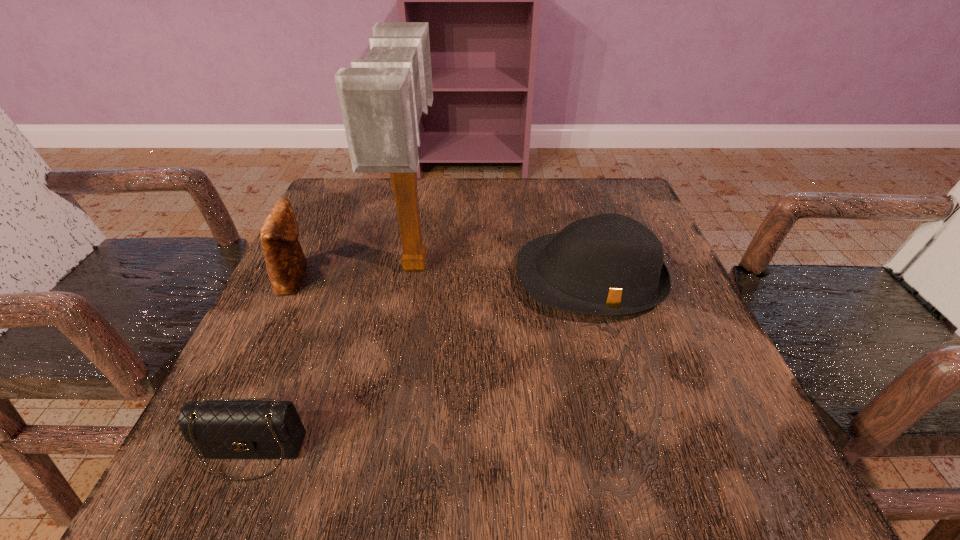
At what (x,y) coordinates should I click in order to perform the action: click on object that is the third closest one to the second shortest object. Please return your answer as a coordinate pair (x, y). Looking at the image, I should click on (285, 261).

Locate which object is the closest to the third tallest object. Please provide its 2D coordinates. Your answer should be formatted as a tuple, i.e. [(x, y)], where the tuple contains the x and y coordinates of a point satisfying the conditions above.

[(382, 97)]

You are a GUI agent. You are given a task and a screenshot of the screen. Output one action in this format:
    pyautogui.click(x=<x>, y=<y>)
    Task: Click on the free location that satisfies the following two spatial constraints: 1. on the front side of the mallet; 2. on the open side of the farther clutch bag
    
    Given the screenshot: What is the action you would take?
    pyautogui.click(x=414, y=277)